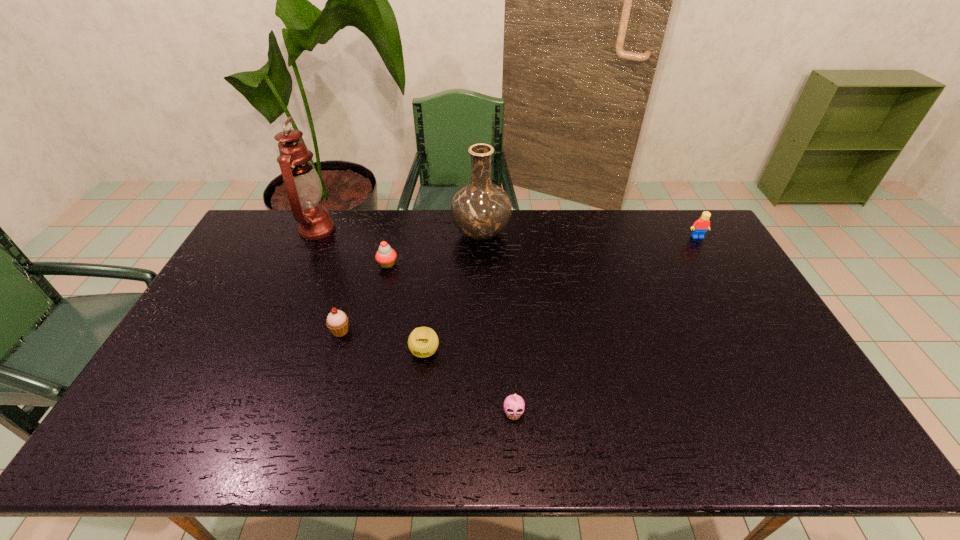
The width and height of the screenshot is (960, 540). Identify the location of object that is the closest to the Lego. [x=481, y=210].

The image size is (960, 540). In order to click on the second closest cupcake to the third object from left to right in this screenshot , I will do `click(515, 404)`.

Locate which cupcake ranks second in proximity to the rightmost cupcake. Please provide its 2D coordinates. Your answer should be formatted as a tuple, i.e. [(x, y)], where the tuple contains the x and y coordinates of a point satisfying the conditions above.

[(385, 256)]

This screenshot has width=960, height=540. What are the coordinates of `vacant space that satisfies the following two spatial constraints: 1. on the back side of the fourth nearest object; 2. on the right side of the vase` in the screenshot? It's located at (395, 234).